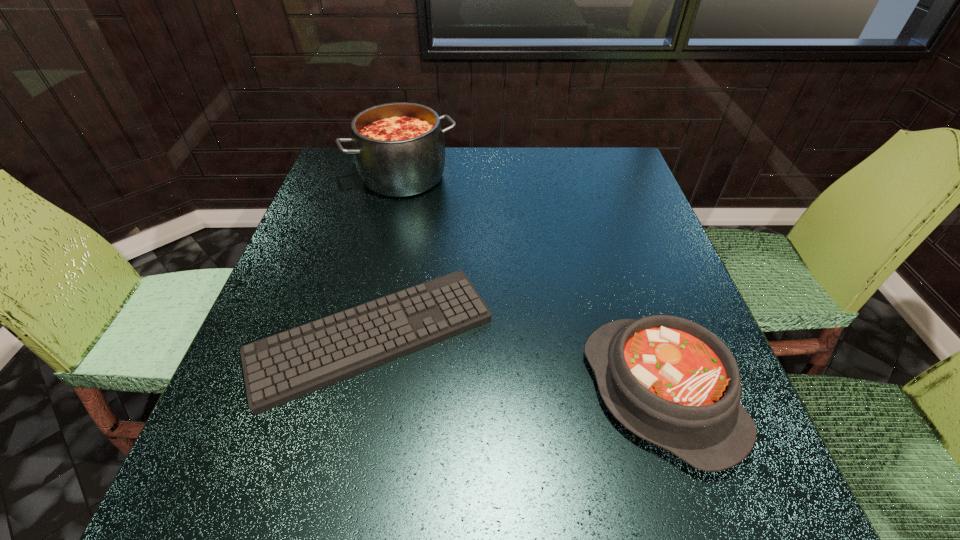
This screenshot has height=540, width=960. What are the coordinates of `empty space between the nearer casserole and the computer keyboard` in the screenshot? It's located at (516, 364).

Identify the location of free space between the farther casserole and the shortest object. (388, 256).

Locate an element on the screen. Image resolution: width=960 pixels, height=540 pixels. unoccupied position between the second shortest object and the left casserole is located at coordinates click(x=532, y=285).

At what (x,y) coordinates should I click in order to perform the action: click on empty location between the left casserole and the computer keyboard. Please return your answer as a coordinate pair (x, y). Looking at the image, I should click on (388, 256).

You are a GUI agent. You are given a task and a screenshot of the screen. Output one action in this format:
    pyautogui.click(x=<x>, y=<y>)
    Task: Click on the empty space that is in between the tallest object and the shortest object
    The image size is (960, 540).
    Given the screenshot: What is the action you would take?
    pyautogui.click(x=388, y=256)

At what (x,y) coordinates should I click in order to perform the action: click on free spot between the nearer casserole and the computer keyboard. Please return your answer as a coordinate pair (x, y). The width and height of the screenshot is (960, 540). Looking at the image, I should click on (516, 364).

The width and height of the screenshot is (960, 540). I want to click on unoccupied area between the taller casserole and the right casserole, so [532, 285].

This screenshot has height=540, width=960. In order to click on free space between the shorter casserole and the shortest object in this screenshot , I will do `click(516, 364)`.

You are a GUI agent. You are given a task and a screenshot of the screen. Output one action in this format:
    pyautogui.click(x=<x>, y=<y>)
    Task: Click on the unoccupied position between the shortest object and the tallest object
    
    Given the screenshot: What is the action you would take?
    pyautogui.click(x=388, y=256)

Locate an element on the screen. The width and height of the screenshot is (960, 540). unoccupied area between the shorter casserole and the taller casserole is located at coordinates (532, 285).